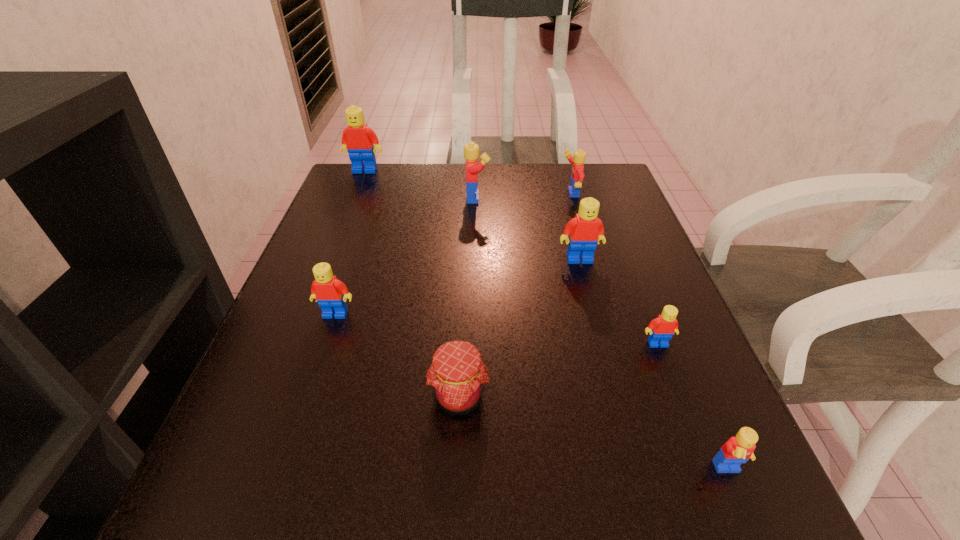
The width and height of the screenshot is (960, 540). In order to click on free point between the rightmost yellow Lego and the leftmost yellow Lego in this screenshot , I will do `click(603, 334)`.

You are a GUI agent. You are given a task and a screenshot of the screen. Output one action in this format:
    pyautogui.click(x=<x>, y=<y>)
    Task: Click on the free point between the smallest yellow Lego and the jam
    
    Given the screenshot: What is the action you would take?
    pyautogui.click(x=594, y=434)

Identify the location of free space between the third Lego from left to right and the nearest red Lego. (567, 271).

Find the location of `empty space that is in between the nearest red Lego and the fifth Lego from right to left`. empty space that is in between the nearest red Lego and the fifth Lego from right to left is located at coordinates (567, 271).

You are a GUI agent. You are given a task and a screenshot of the screen. Output one action in this format:
    pyautogui.click(x=<x>, y=<y>)
    Task: Click on the object that is the fourth closest one to the third smallest red Lego
    The width and height of the screenshot is (960, 540).
    Given the screenshot: What is the action you would take?
    pyautogui.click(x=457, y=375)

The image size is (960, 540). Identify the location of object that ranks as the seventh closest to the biggest yellow Lego. (737, 450).

Select which Lego is the fourth closest to the fifth Lego from right to left. Please provide its 2D coordinates. Your answer should be formatted as a tuple, i.e. [(x, y)], where the tuple contains the x and y coordinates of a point satisfying the conditions above.

[(331, 294)]

In order to click on the sixth closest Lego to the biggest yellow Lego in this screenshot , I will do `click(737, 450)`.

Identify which red Lego is located as the third nearest to the jam. Please provide its 2D coordinates. Your answer should be formatted as a tuple, i.e. [(x, y)], where the tuple contains the x and y coordinates of a point satisfying the conditions above.

[(585, 230)]

Locate which red Lego ranks third in proximity to the red jam. Please provide its 2D coordinates. Your answer should be formatted as a tuple, i.e. [(x, y)], where the tuple contains the x and y coordinates of a point satisfying the conditions above.

[(585, 230)]